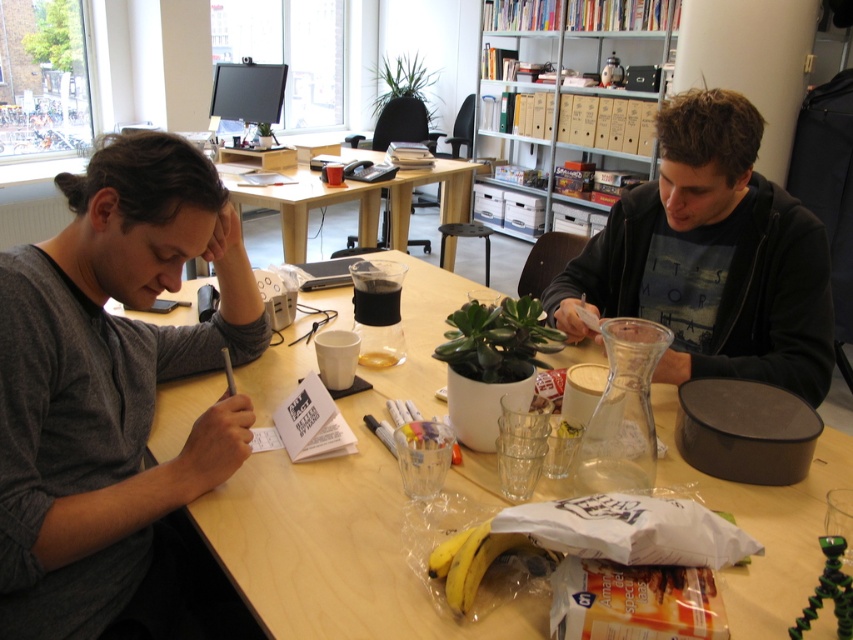
Does gray cotton shirt at left appear under wooden table at center?

Yes.

Can you confirm if gray cotton shirt at left is smaller than wooden table at center?

Indeed, gray cotton shirt at left has a smaller size compared to wooden table at center.

Is point (84, 371) more distant than point (431, 346)?

No, it is in front of (431, 346).

You are a GUI agent. You are given a task and a screenshot of the screen. Output one action in this format:
    pyautogui.click(x=<x>, y=<y>)
    Task: Click on the gray cotton shirt at left
    
    Given the screenshot: What is the action you would take?
    pyautogui.click(x=119, y=403)

Can you confirm if gray cotton shirt at left is positioned to the right of black matte hoodie at center?

Incorrect, gray cotton shirt at left is not on the right side of black matte hoodie at center.

What do you see at coordinates (119, 403) in the screenshot? I see `gray cotton shirt at left` at bounding box center [119, 403].

Identify the location of gray cotton shirt at left. (119, 403).

Between gray cotton shirt at left and light wood table at center, which one is positioned lower?

Positioned lower is gray cotton shirt at left.

Who is more distant from viewer, [260,321] or [399,186]?

The point [399,186] is more distant.

The image size is (853, 640). Find the location of `gray cotton shirt at left`. gray cotton shirt at left is located at coordinates (119, 403).